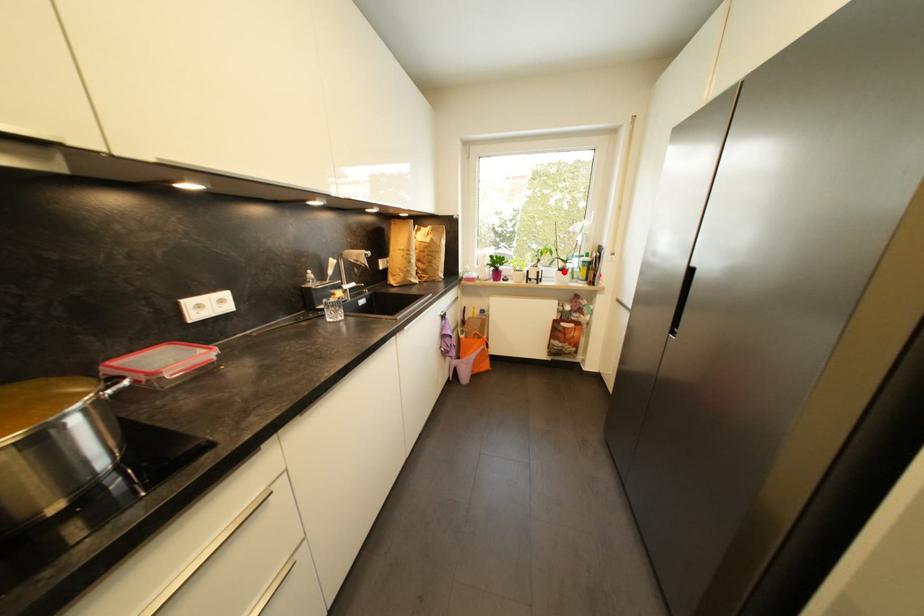
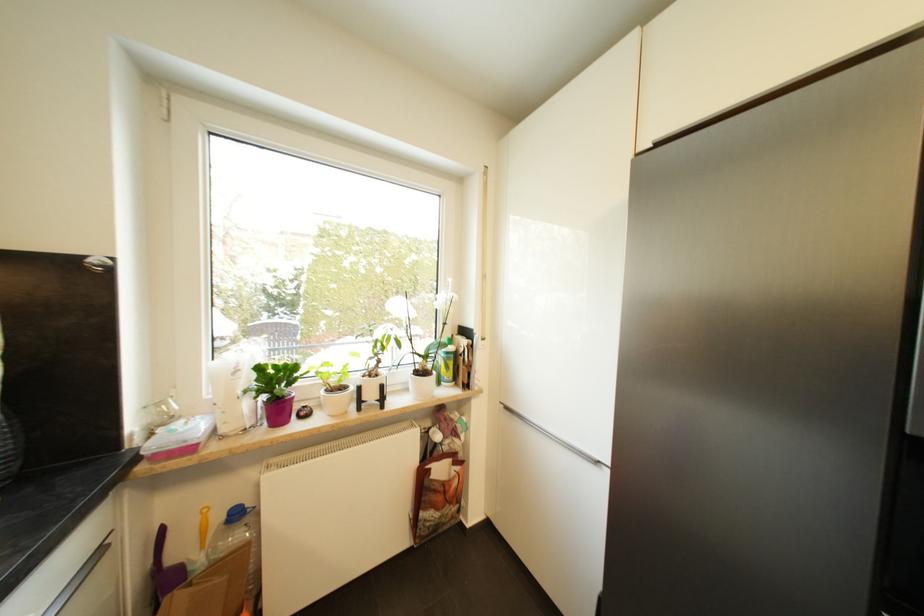
Question: I am providing you with two images of the same scene from different viewpoints. A red point is marked on the first image. Can you still see the location of the red point in image 2?

Choices:
 (A) Yes
 (B) No

Answer: (A)